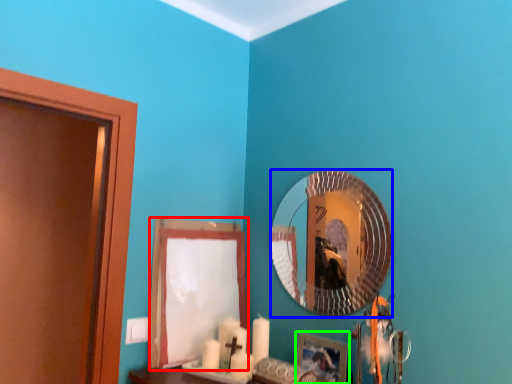
Question: Which object is positioned closest to curtain (highlighted by a red box)? Select from mirror (highlighted by a blue box) and picture frame (highlighted by a green box).

Choices:
 (A) mirror
 (B) picture frame

Answer: (A)